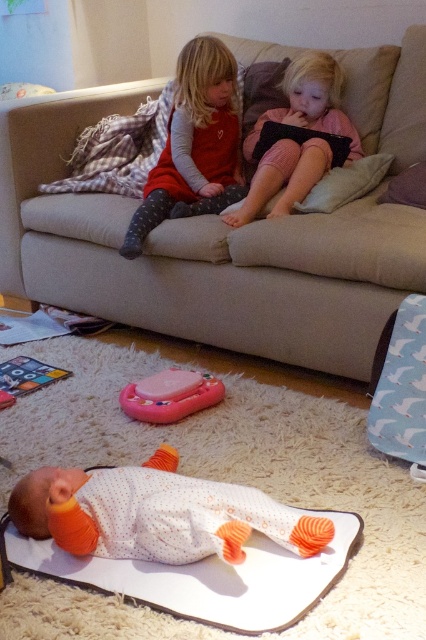
Which is in front, point (224, 80) or point (135, 403)?

Positioned in front is point (135, 403).

Is point (172, 209) less distant than point (178, 390)?

No.

Is point (172, 156) farther from viewer compared to point (215, 385)?

Yes, point (172, 156) is behind point (215, 385).

The image size is (426, 640). I want to click on matte red dress at upper center, so click(193, 145).

Does matte red dress at upper center appear on the left side of white soft pillow at center?

Indeed, matte red dress at upper center is positioned on the left side of white soft pillow at center.

Does point (224, 93) lie behind point (333, 195)?

Yes, point (224, 93) is farther from viewer.

Between point (232, 186) and point (345, 193), which one is positioned in front?

Point (345, 193)

Where is `matte red dress at upper center`? matte red dress at upper center is located at coordinates (193, 145).

Is point (192, 545) positioned behind point (204, 163)?

No.

Can you confirm if white dotted fabric baby at center is bigger than matte red dress at upper center?

No, white dotted fabric baby at center is not bigger than matte red dress at upper center.

Which is behind, point (81, 524) or point (227, 147)?

Positioned behind is point (227, 147).

Identify the location of white dotted fabric baby at center. The width and height of the screenshot is (426, 640). (158, 515).